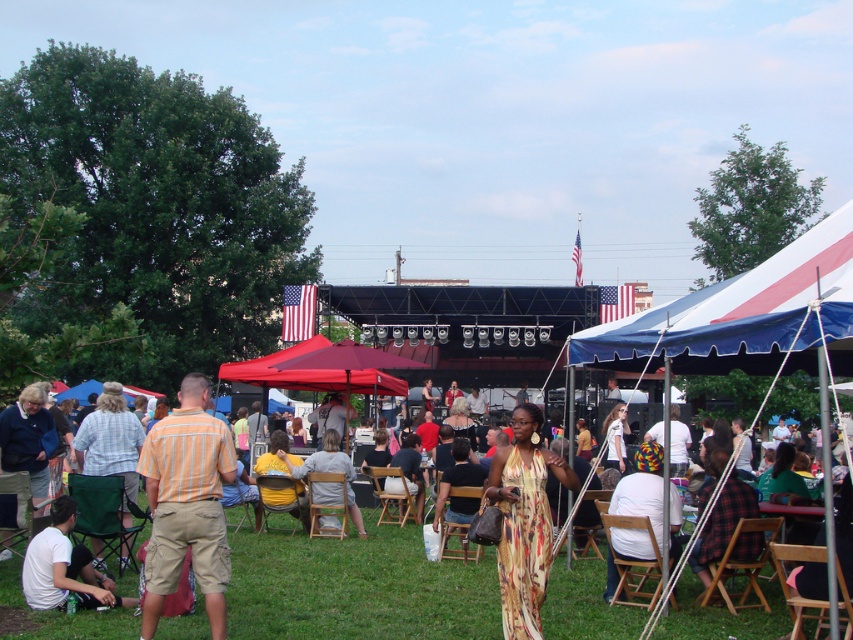
Does blue/white striped canopy at upper right lie in front of blue fleece jacket at lower left?

Yes, it is in front of blue fleece jacket at lower left.

The height and width of the screenshot is (640, 853). Describe the element at coordinates (744, 316) in the screenshot. I see `blue/white striped canopy at upper right` at that location.

Where is `blue/white striped canopy at upper right`? blue/white striped canopy at upper right is located at coordinates (744, 316).

Can you confirm if blue/white striped canopy at center-right is positioned to the left of light brown wood chair at center?

No, blue/white striped canopy at center-right is not to the left of light brown wood chair at center.

Does blue/white striped canopy at center-right have a smaller size compared to light brown wood chair at center?

Indeed, blue/white striped canopy at center-right has a smaller size compared to light brown wood chair at center.

Identify the location of blue/white striped canopy at center-right. (747, 314).

Which is in front, point (229, 448) or point (521, 451)?

Positioned in front is point (229, 448).

Locate an element on the screen. The height and width of the screenshot is (640, 853). orange striped shirt at center is located at coordinates (186, 502).